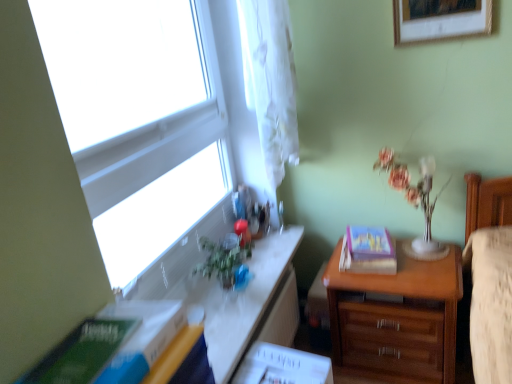
Question: Is white glossy table at upper left in front of or behind wooden picture frame at upper right in the image?

Choices:
 (A) behind
 (B) front

Answer: (B)

Question: Would you say white glossy table at upper left is to the left or to the right of wooden picture frame at upper right in the picture?

Choices:
 (A) left
 (B) right

Answer: (A)

Question: Estimate the real-world distances between objects in this image. Which object is farther from the translucent glass vase at upper right?

Choices:
 (A) hardcover book at right, which appears as the first paperback book when viewed from the right
 (B) green matte paperback book at lower left, the first paperback book positioned from the left
 (C) transparent glass window at upper left
 (D) white sheer curtain at upper left
 (E) wooden chest of drawers at right

Answer: (B)

Question: Which object is the closest to the hardcover book at right, arranged as the 2th paperback book when viewed from the left?

Choices:
 (A) transparent glass window at upper left
 (B) wooden chest of drawers at right
 (C) green matte paperback book at lower left, positioned as the second paperback book in back-to-front order
 (D) translucent glass vase at upper right
 (E) white glossy table at upper left

Answer: (B)